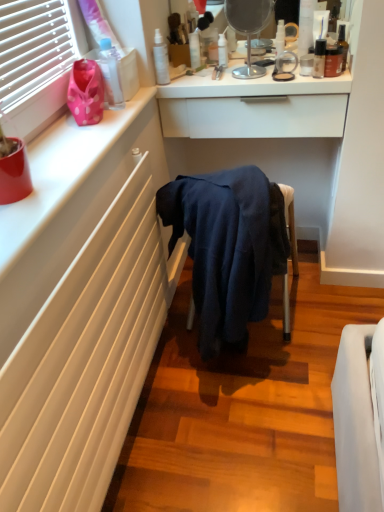
Where is `free space in front of transparent plastic bottle at upper left, which is the first toiletry from left to right`? The width and height of the screenshot is (384, 512). free space in front of transparent plastic bottle at upper left, which is the first toiletry from left to right is located at coordinates (100, 128).